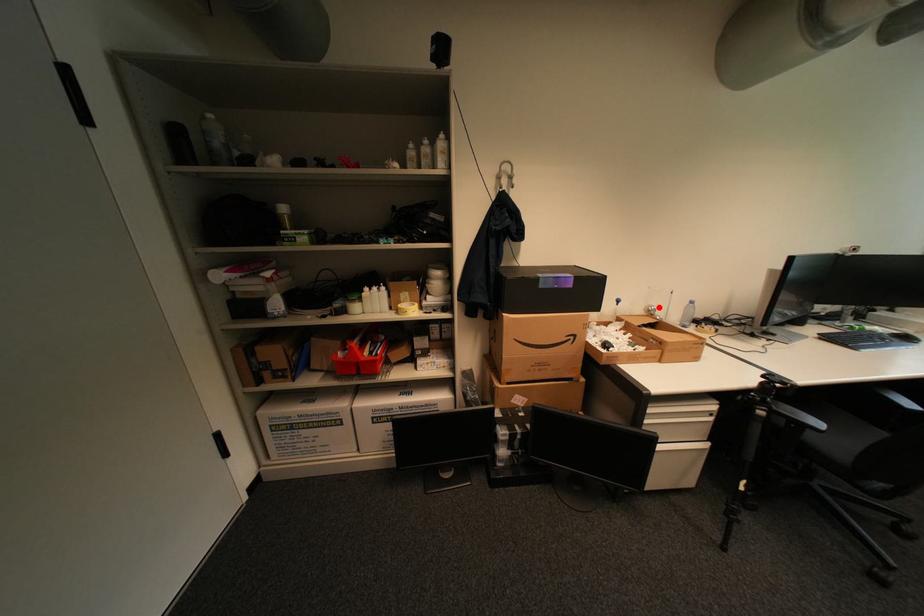
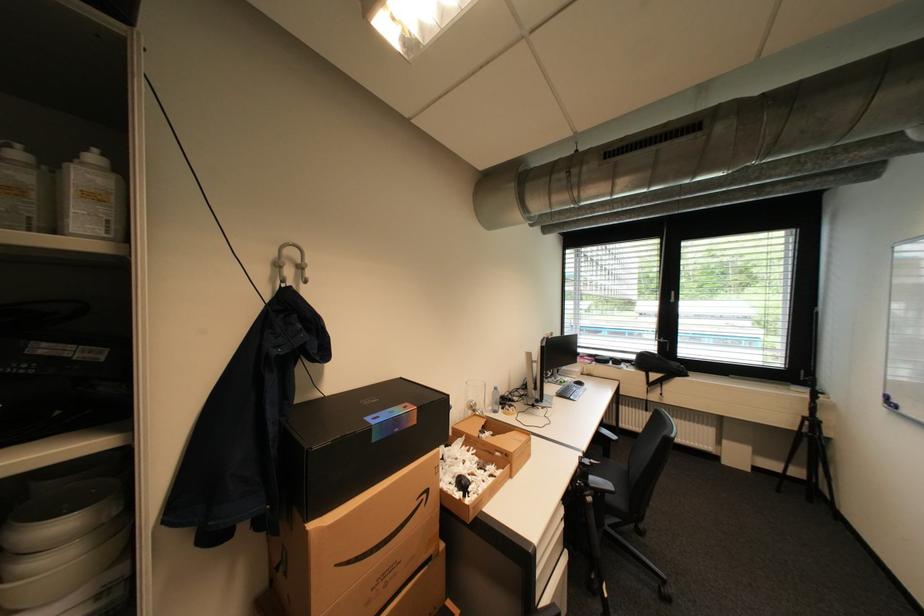
Question: I am providing you with two images of the same scene from different viewpoints. A red point is shown in image1. For the corresponding object point in image2, is it positioned nearer or farther from the camera?

Choices:
 (A) Nearer
 (B) Farther

Answer: (B)